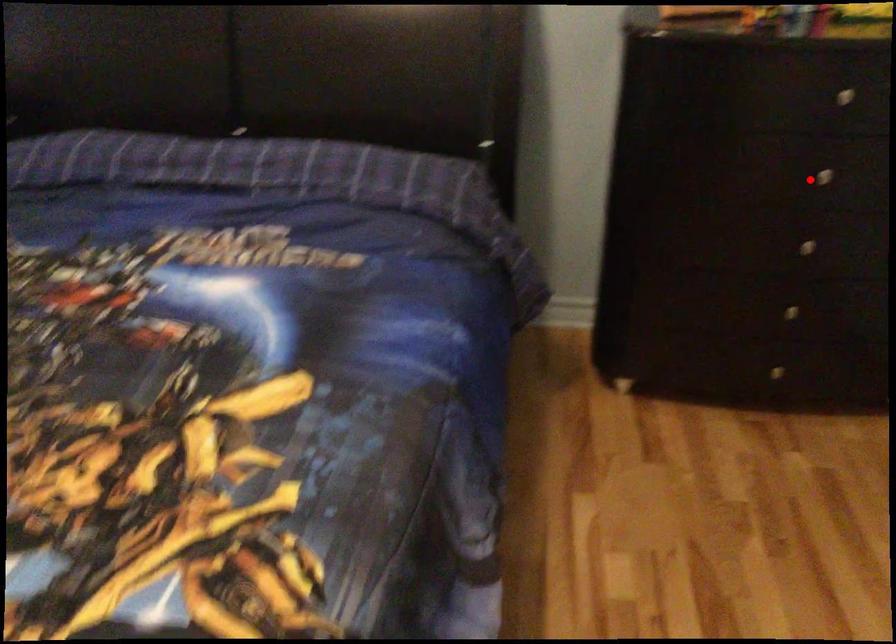
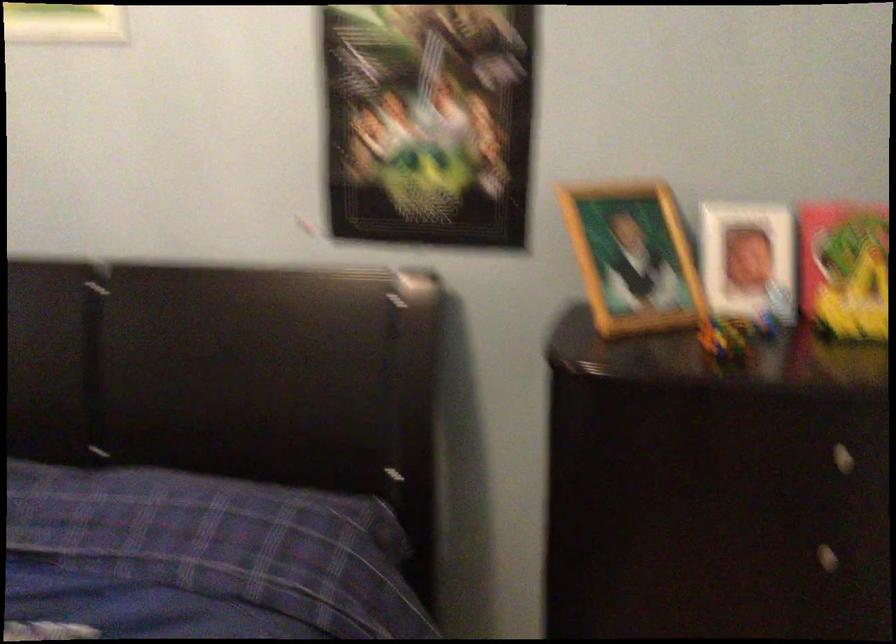
In the second image, find the point that corresponds to the highlighted location in the first image.

(807, 554)